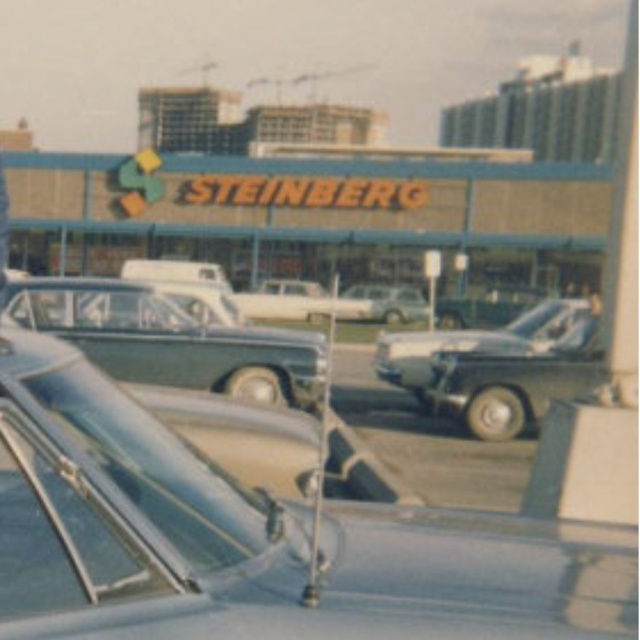
You are standing in front of the building with the STEINBERG sign and want to walk to the point that is closer to you. Which point should you head towards, point at position (26,320) or point at position (236,301)?

You should head towards point at position (26,320) because it is closer to the viewer than point at position (236,301).

You are a delivery person who needs to park a 20 feet long truck between the shiny silver sedan at center and the white glossy station wagon at center. Can you fit the truck in the space between them?

The space between the shiny silver sedan at center and the white glossy station wagon at center is 86.82 feet. Since the truck is only 20 feet long, there is sufficient space to park the truck between them.

You are a delivery person who needs to unload a package between the white glossy station wagon at center and the white glossy sedan at center. The package requires a space of 7 feet. Is there enough space between them?

The white glossy station wagon at center and white glossy sedan at center are 6.66 feet apart, so there is not enough space to unload the package that requires 7 feet of space between them.